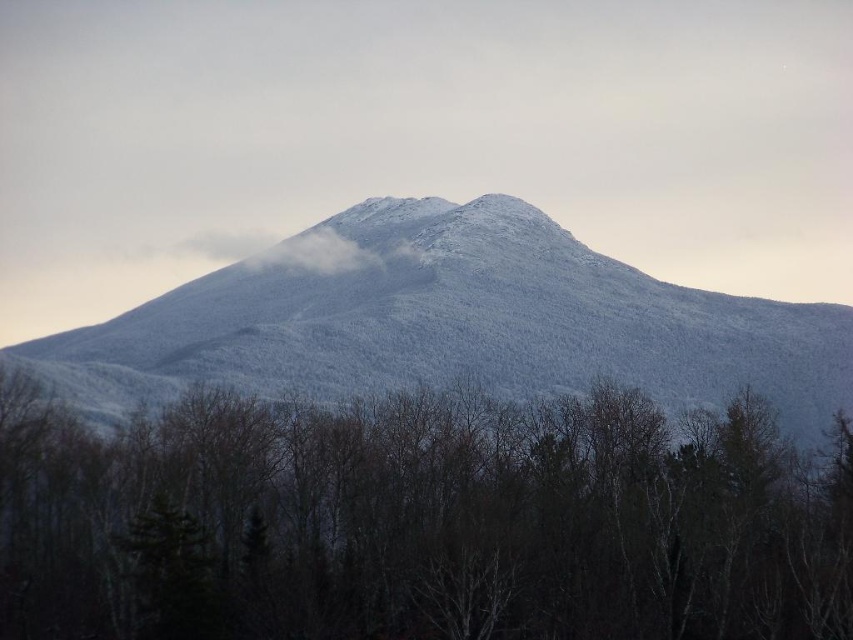
Does white matte tree at center have a larger size compared to white frosty mountain at center?

No.

At what (x,y) coordinates should I click in order to perform the action: click on white matte tree at center. Please return your answer as a coordinate pair (x, y). The image size is (853, 640). Looking at the image, I should click on (416, 522).

I want to click on white matte tree at center, so click(416, 522).

How far apart are white matte tree at center and white fluffy cloud at upper center?

white matte tree at center and white fluffy cloud at upper center are 203.30 feet apart.

Is point (496, 492) positioned after point (347, 241)?

No, it is in front of (347, 241).

Between point (529, 525) and point (398, 244), which one is positioned in front?

Point (529, 525) is more forward.

The image size is (853, 640). Find the location of `white matte tree at center`. white matte tree at center is located at coordinates (416, 522).

Is white frosty mountain at center bigger than white fluffy cloud at upper center?

Indeed, white frosty mountain at center has a larger size compared to white fluffy cloud at upper center.

Between point (654, 291) and point (288, 248), which one is positioned in front?

Positioned in front is point (654, 291).

Is point (268, 340) behind point (323, 228)?

That is False.

Locate an element on the screen. white frosty mountain at center is located at coordinates (460, 326).